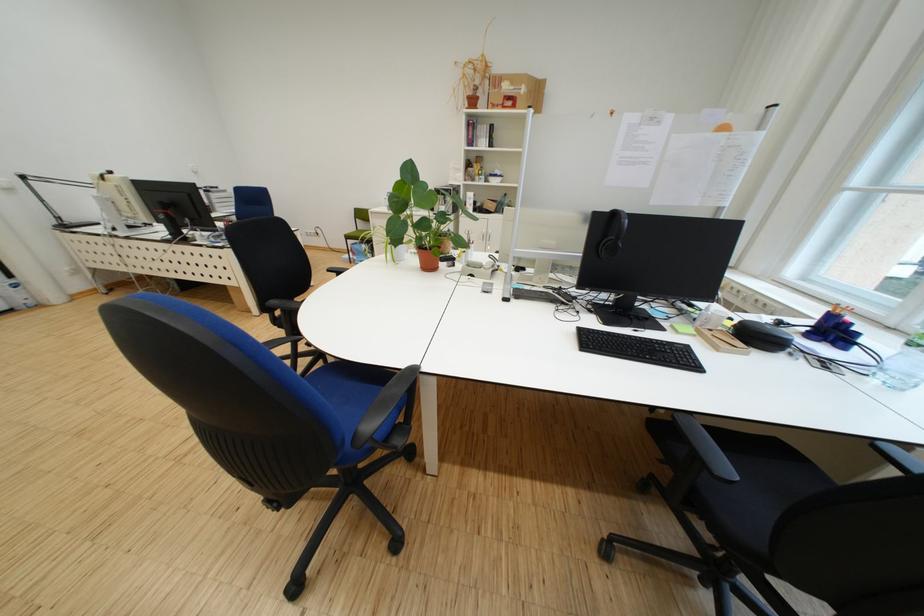
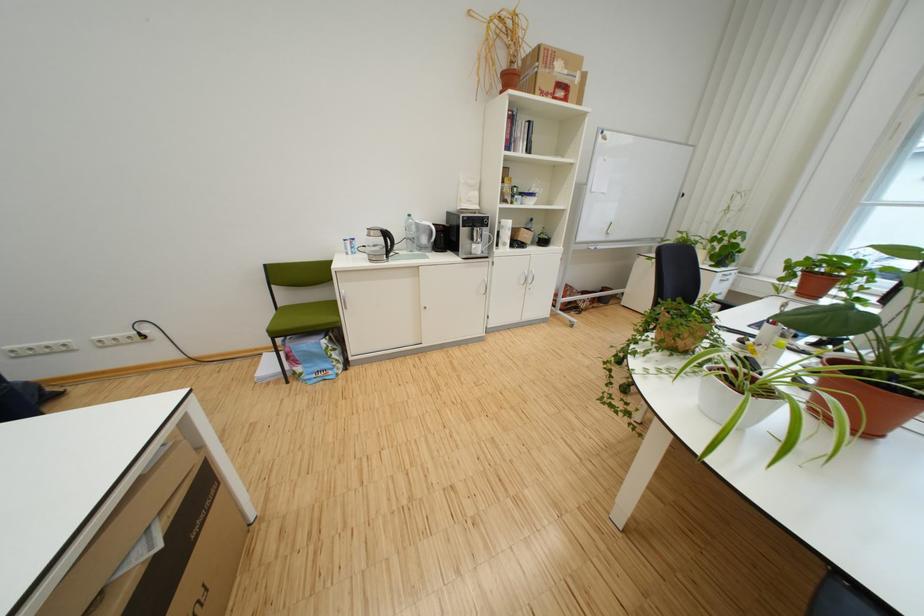
In the second image, find the point that corresponds to (x=505, y=108) in the first image.

(553, 95)